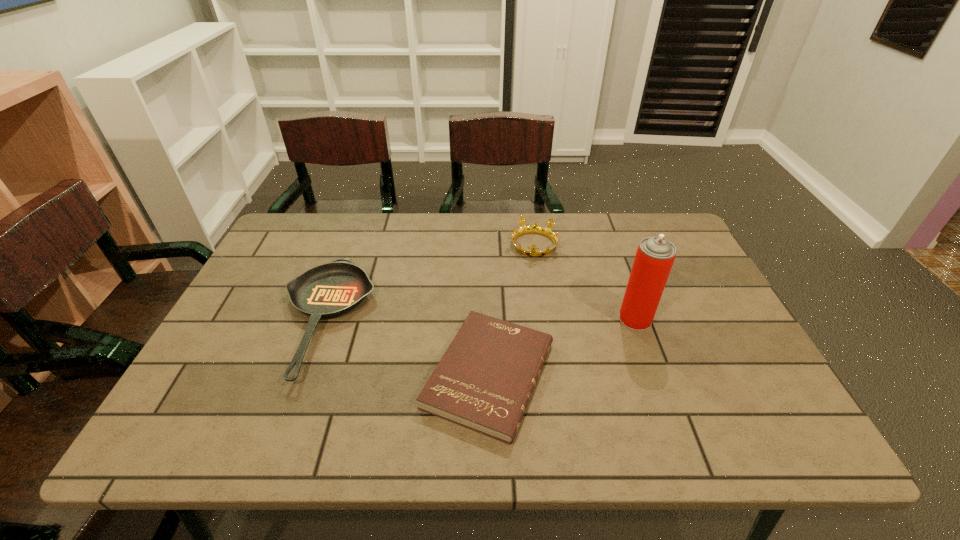
At what (x,y) coordinates should I click in order to perform the action: click on empty location between the crown and the aerosol can. Please return your answer as a coordinate pair (x, y). Looking at the image, I should click on (585, 282).

Where is `vacant region between the hardback book and the farthest object`? This screenshot has width=960, height=540. vacant region between the hardback book and the farthest object is located at coordinates (512, 310).

This screenshot has height=540, width=960. I want to click on vacant point located between the hardback book and the frying pan, so [407, 347].

At what (x,y) coordinates should I click in order to perform the action: click on blank region between the tallest object and the hardback book. Please return your answer as a coordinate pair (x, y). Looking at the image, I should click on (563, 347).

Locate an element on the screen. vacant space that is in between the hardback book and the rightmost object is located at coordinates (563, 347).

At what (x,y) coordinates should I click in order to perform the action: click on blank region between the hardback book and the rightmost object. Please return your answer as a coordinate pair (x, y). The image size is (960, 540). Looking at the image, I should click on (563, 347).

What are the coordinates of `empty location between the leftmost object and the crown` in the screenshot? It's located at (428, 282).

Locate which object ranks second in proximity to the leftmost object. Please provide its 2D coordinates. Your answer should be formatted as a tuple, i.e. [(x, y)], where the tuple contains the x and y coordinates of a point satisfying the conditions above.

[(535, 228)]

Identify the location of object that ranks as the second closest to the hardback book. The image size is (960, 540). (654, 258).

The image size is (960, 540). Identify the location of free spot that satisfies the following two spatial constraints: 1. on the back side of the aerosol can; 2. on the left side of the frying pan. (324, 319).